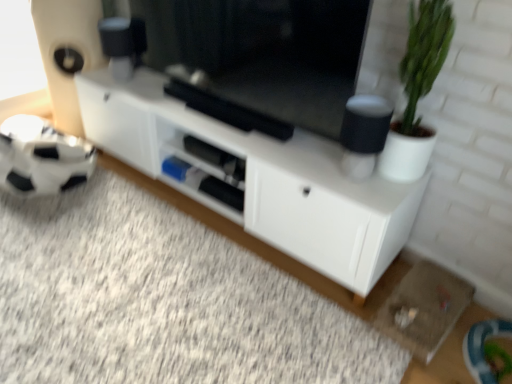
The height and width of the screenshot is (384, 512). What are the coordinates of `vacant space in front of green matte plant at right` in the screenshot? It's located at (382, 196).